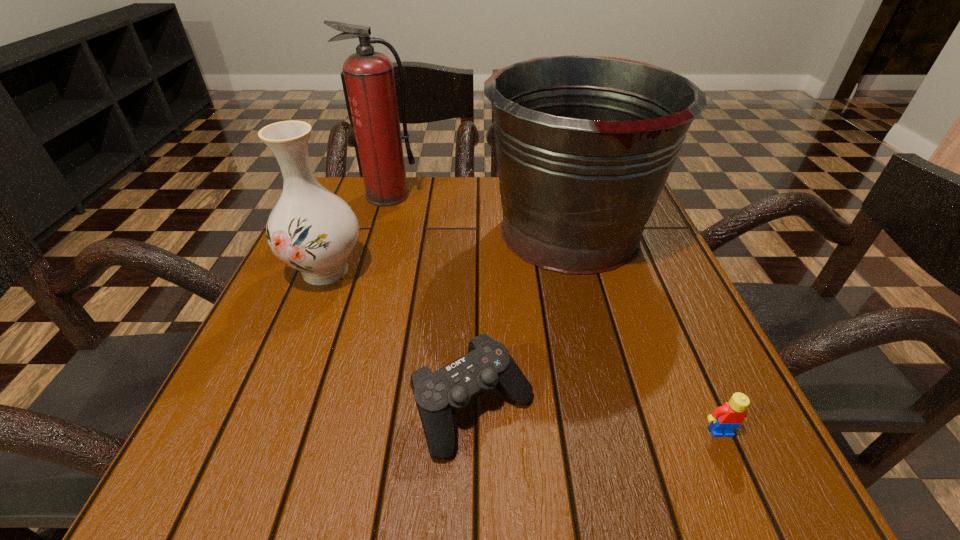
Find the location of a particular element. The width and height of the screenshot is (960, 540). object present at the near right corner is located at coordinates (725, 418).

In the image, there is a desktop. Where is `vacant region at the far edge`? The image size is (960, 540). vacant region at the far edge is located at coordinates tap(500, 198).

You are a GUI agent. You are given a task and a screenshot of the screen. Output one action in this format:
    pyautogui.click(x=<x>, y=<y>)
    Task: Click on the vacant area at the near edge
    The width and height of the screenshot is (960, 540).
    Given the screenshot: What is the action you would take?
    pyautogui.click(x=332, y=461)

Find the location of a particular element. This screenshot has height=540, width=960. vacant space at the left edge of the desktop is located at coordinates (319, 311).

In the image, there is a desktop. What are the coordinates of `vacant space at the right edge` in the screenshot? It's located at (671, 336).

Locate an element on the screen. The height and width of the screenshot is (540, 960). vacant space that's between the bucket and the tallest object is located at coordinates (479, 213).

Where is `vacant area that lies between the bucket and the Lego`? The image size is (960, 540). vacant area that lies between the bucket and the Lego is located at coordinates (645, 331).

Find the location of `vacant area that lies between the tallest object and the Lego`. vacant area that lies between the tallest object and the Lego is located at coordinates (555, 313).

Identify the location of free space between the tallest object and the bucket. The height and width of the screenshot is (540, 960). (479, 213).

Locate an element on the screen. The width and height of the screenshot is (960, 540). free area in between the control and the bucket is located at coordinates (521, 320).